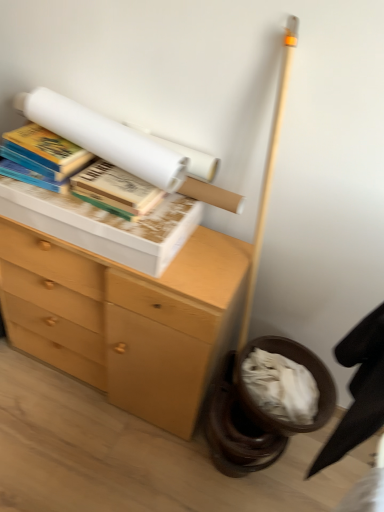
Locate an element on the screen. The width and height of the screenshot is (384, 512). blank space above hardcover book at upper left, the 1th book from the right (from a real-world perspective) is located at coordinates (120, 178).